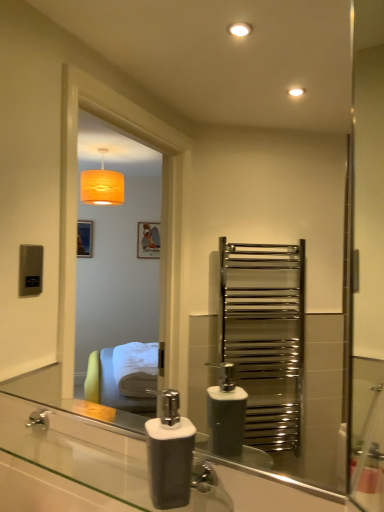
Question: From their relative heights in the image, would you say white matte soap dispenser at lower center is taller or shorter than translucent glass soap dispenser at lower center?

Choices:
 (A) tall
 (B) short

Answer: (A)

Question: Relative to translucent glass soap dispenser at lower center, is white matte soap dispenser at lower center in front or behind?

Choices:
 (A) behind
 (B) front

Answer: (A)

Question: From the image's perspective, is white matte soap dispenser at lower center positioned above or below translucent glass soap dispenser at lower center?

Choices:
 (A) below
 (B) above

Answer: (B)

Question: Is translucent glass soap dispenser at lower center spatially inside white matte soap dispenser at lower center, or outside of it?

Choices:
 (A) outside
 (B) inside

Answer: (A)

Question: Based on their sizes in the image, would you say translucent glass soap dispenser at lower center is bigger or smaller than white matte soap dispenser at lower center?

Choices:
 (A) big
 (B) small

Answer: (A)

Question: From a real-world perspective, is translucent glass soap dispenser at lower center positioned above or below white matte soap dispenser at lower center?

Choices:
 (A) above
 (B) below

Answer: (B)

Question: In the image, is translucent glass soap dispenser at lower center on the left side or the right side of white matte soap dispenser at lower center?

Choices:
 (A) left
 (B) right

Answer: (A)